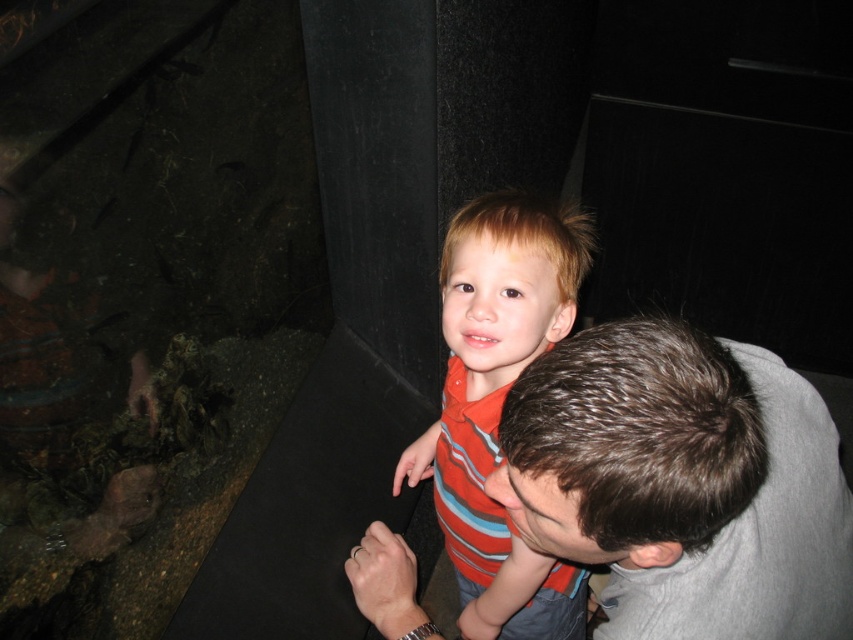
You are a security guard in the museum and need to ensure that the gray smooth shirt at upper right and the striped cotton shirt at center are visible in the surveillance footage. Given that the camera has a minimum height requirement of 1 meter to capture objects clearly, can both shirts be captured adequately?

The gray smooth shirt at upper right is not as tall as striped cotton shirt at center. Since the striped cotton shirt at center is taller than 1 meter, it meets the camera requirement. However, the gray smooth shirt at upper right is shorter and may not be captured clearly if it is below the 1 meter height threshold.

You are a tailor trying to determine which shirt to recommend to a customer based on size. The customer wants a shirt that is wider than the other. Given the scene, which shirt between the gray smooth shirt at upper right and the striped cotton shirt at center would you suggest?

The gray smooth shirt at upper right is wider than the striped cotton shirt at center, so I would recommend the gray smooth shirt at upper right.